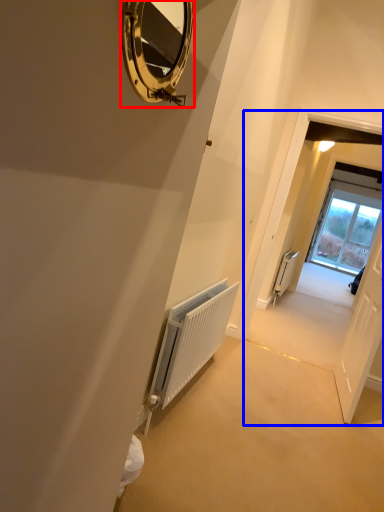
Question: Which of the following is the farthest to the observer, mirror (highlighted by a red box) or corridor (highlighted by a blue box)?

Choices:
 (A) mirror
 (B) corridor

Answer: (B)